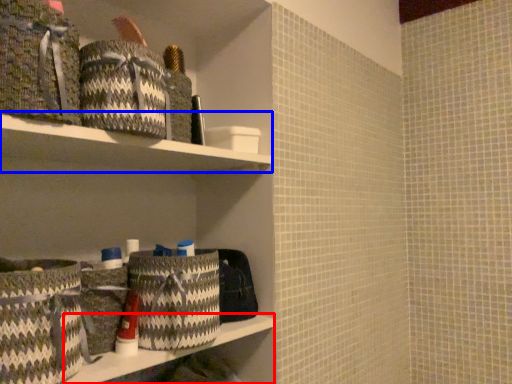
Question: Which object appears farthest to the camera in this image, ledge (highlighted by a red box) or cabinet (highlighted by a blue box)?

Choices:
 (A) ledge
 (B) cabinet

Answer: (A)